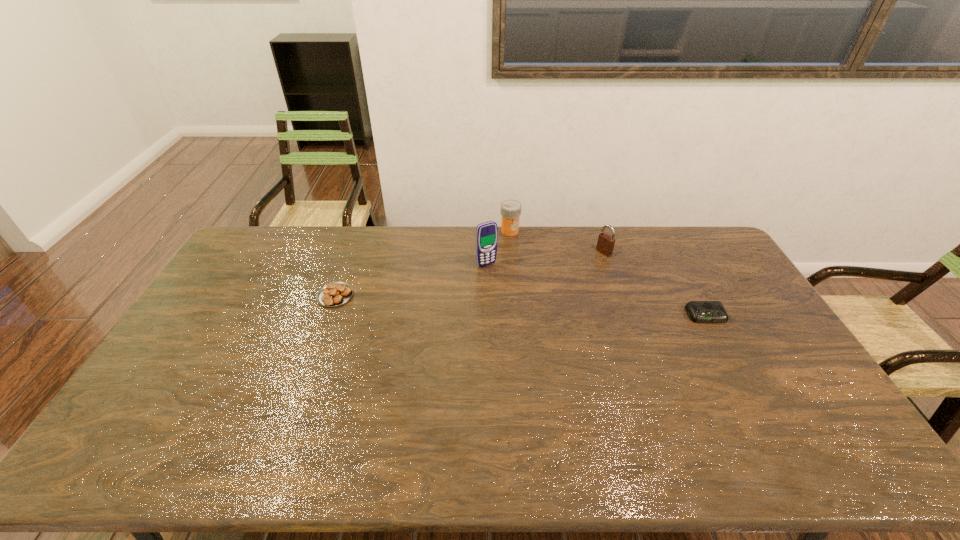
Find the location of a particular element. free space between the farthest object and the tallest object is located at coordinates (498, 248).

Where is `vacant space in between the alarm clock and the padlock`? The image size is (960, 540). vacant space in between the alarm clock and the padlock is located at coordinates (655, 284).

Locate an element on the screen. The width and height of the screenshot is (960, 540). free space between the third object from right to left and the leftmost object is located at coordinates (422, 264).

Where is `free point between the third object from left to right and the second object from right to left`? free point between the third object from left to right and the second object from right to left is located at coordinates (557, 241).

Where is `free spot between the rightmost object and the pastry`? Image resolution: width=960 pixels, height=540 pixels. free spot between the rightmost object and the pastry is located at coordinates (520, 306).

In order to click on empty space that is in between the alarm clock and the tallest object in this screenshot , I will do `click(596, 290)`.

Where is `vacant space that's between the third farthest object and the pastry`? vacant space that's between the third farthest object and the pastry is located at coordinates (411, 280).

This screenshot has width=960, height=540. Find the location of `free space between the tallest object and the pastry`. free space between the tallest object and the pastry is located at coordinates 411,280.

Identify which object is the nearest to the pastry. Please provide its 2D coordinates. Your answer should be formatted as a tuple, i.e. [(x, y)], where the tuple contains the x and y coordinates of a point satisfying the conditions above.

[(486, 233)]

Identify which object is located as the fourth nearest to the pastry. Please provide its 2D coordinates. Your answer should be formatted as a tuple, i.e. [(x, y)], where the tuple contains the x and y coordinates of a point satisfying the conditions above.

[(699, 311)]